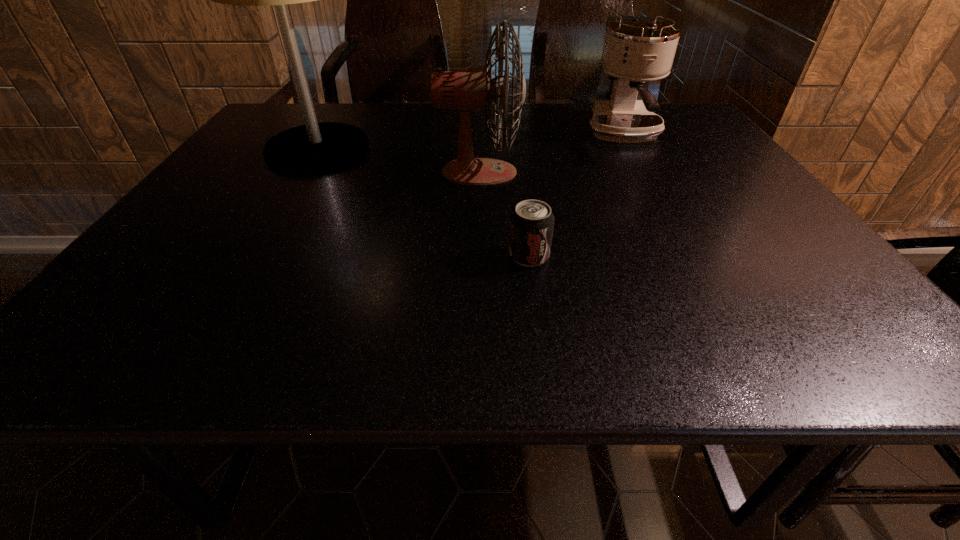
This screenshot has width=960, height=540. I want to click on table lamp, so click(x=312, y=148).

I want to click on the leftmost object, so click(x=312, y=148).

Identify the location of fan. (473, 89).

This screenshot has width=960, height=540. I want to click on the rightmost object, so click(x=636, y=50).

The image size is (960, 540). I want to click on the shortest object, so click(531, 224).

Where is `the nearest object`? The image size is (960, 540). the nearest object is located at coordinates pyautogui.click(x=531, y=224).

The image size is (960, 540). What are the coordinates of `vacant region located on the right of the table lamp` in the screenshot? It's located at (398, 149).

Find the location of a particular element. free space located in front of the fan to direct airflow is located at coordinates (605, 173).

Image resolution: width=960 pixels, height=540 pixels. I want to click on blank space located on the front-facing side of the coffee maker, so click(x=659, y=192).

Where is `vacant space situated 0.050m on the right of the nearest object`? This screenshot has width=960, height=540. vacant space situated 0.050m on the right of the nearest object is located at coordinates (575, 255).